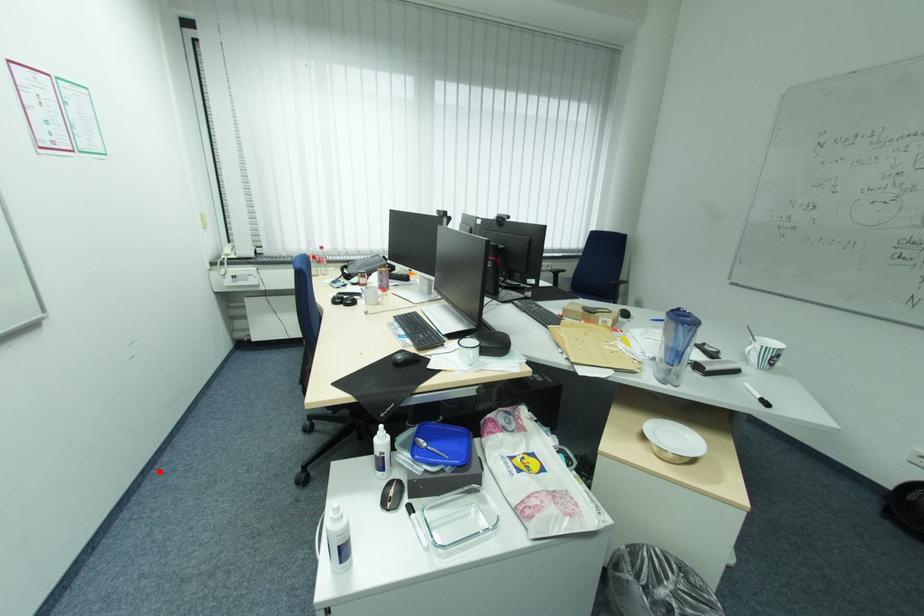
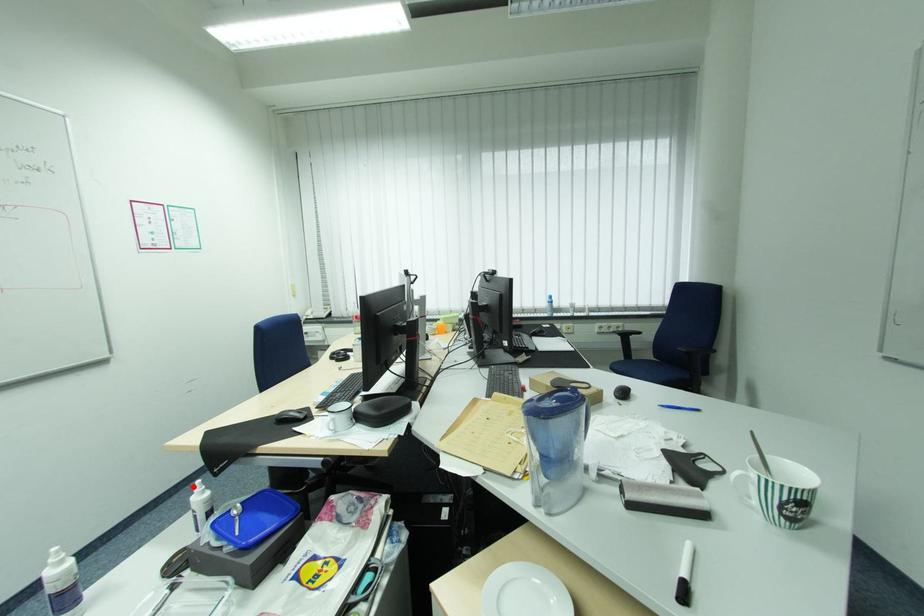
I am providing you with two images of the same scene from different viewpoints. A red point is marked on the first image and another point is marked on the second image. Do the highlighted points in image1 and image2 indicate the same real-world spot?

Yes